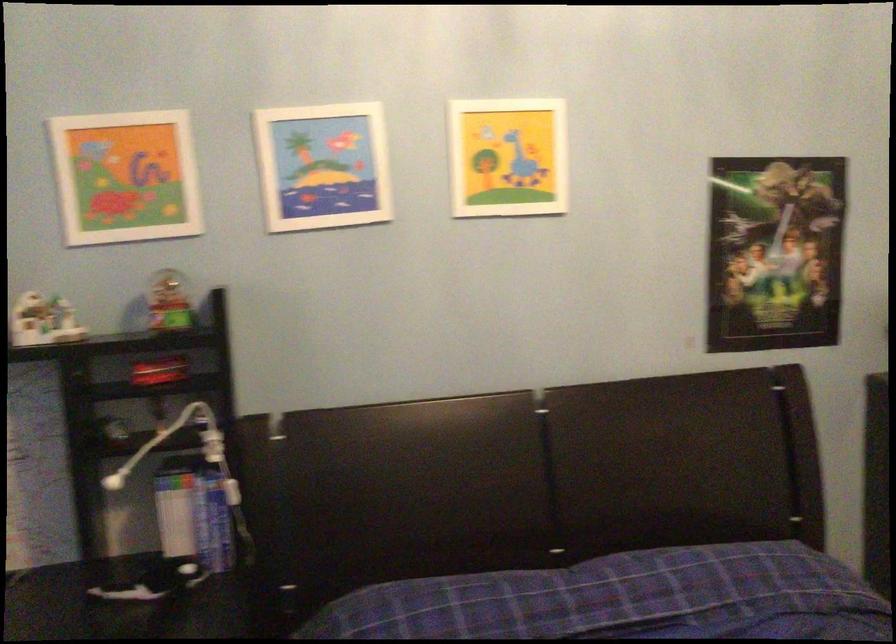
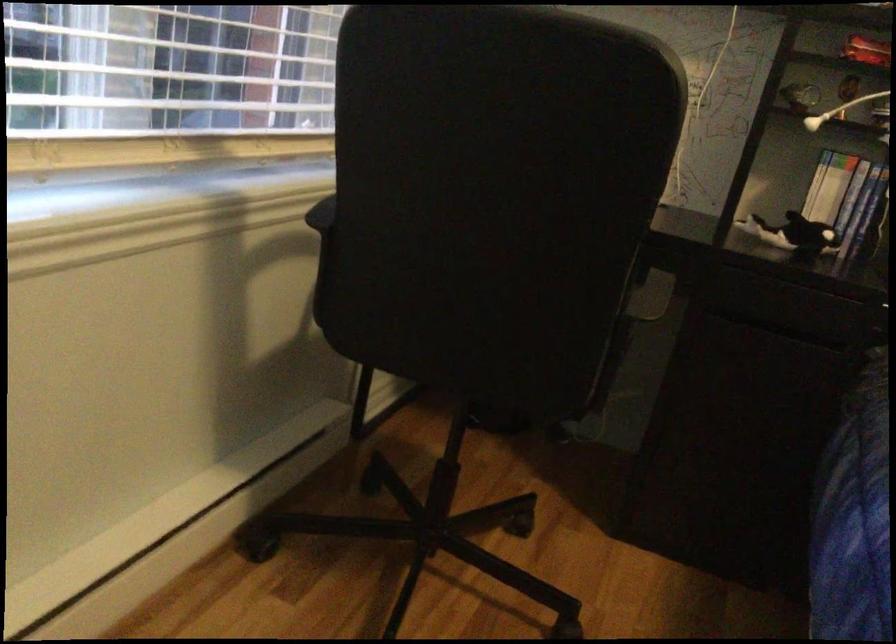
Where in the second image is the point corresponding to pixel 154 426 from the first image?

(839, 109)